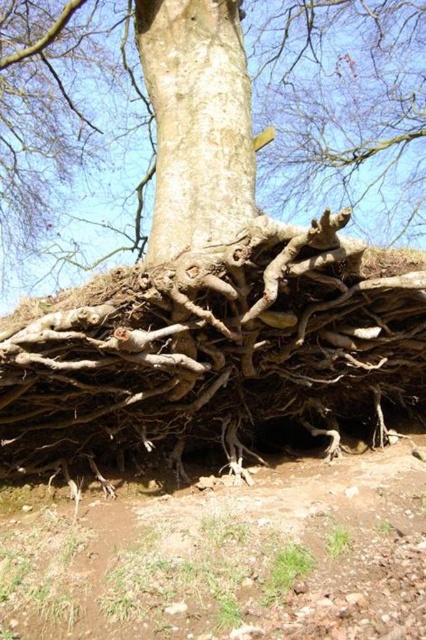
How far apart are brown soil at lower center and smooth brown bark at center?

They are 7.97 feet apart.

Who is positioned more to the right, brown soil at lower center or smooth brown bark at center?

brown soil at lower center

Between point (173, 561) and point (213, 129), which one is positioned behind?

The point (213, 129) is more distant.

Find the location of a particular element. This screenshot has width=426, height=640. brown soil at lower center is located at coordinates (224, 556).

Does brown rough roots at center appear over barky brown roots at center?

No.

How much distance is there between brown rough roots at center and barky brown roots at center?

brown rough roots at center and barky brown roots at center are 24.81 feet apart.

Identify the location of brown rough roots at center. This screenshot has width=426, height=640. (207, 346).

Which is below, brown soil at lower center or barky brown roots at center?

brown soil at lower center is below.

Is brown soil at lower center bigger than barky brown roots at center?

Yes.

Identify the location of brown soil at lower center. The height and width of the screenshot is (640, 426). (224, 556).